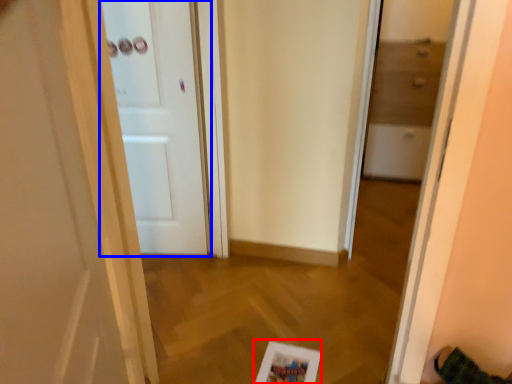
Question: Which point is closer to the camera, picture frame (highlighted by a red box) or door (highlighted by a blue box)?

Choices:
 (A) picture frame
 (B) door

Answer: (A)